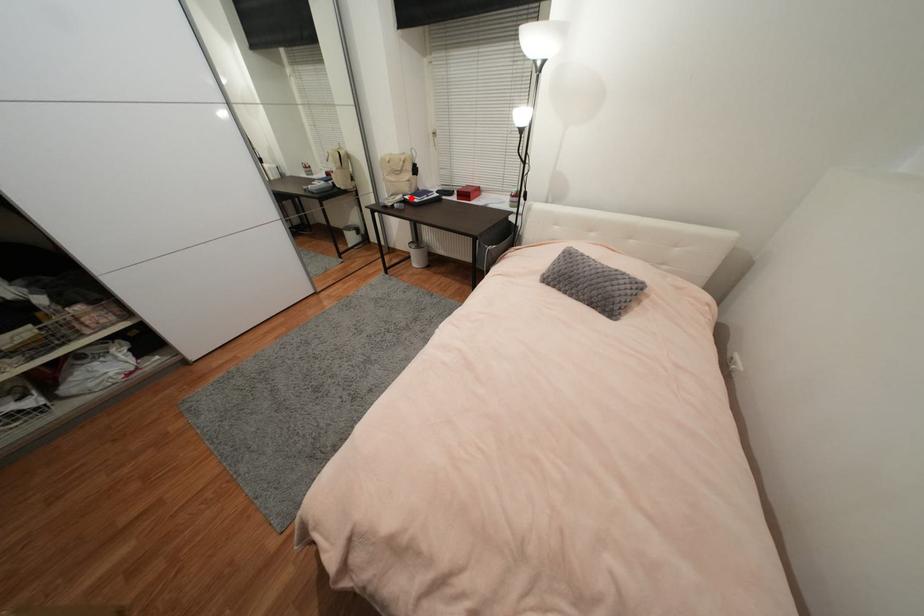
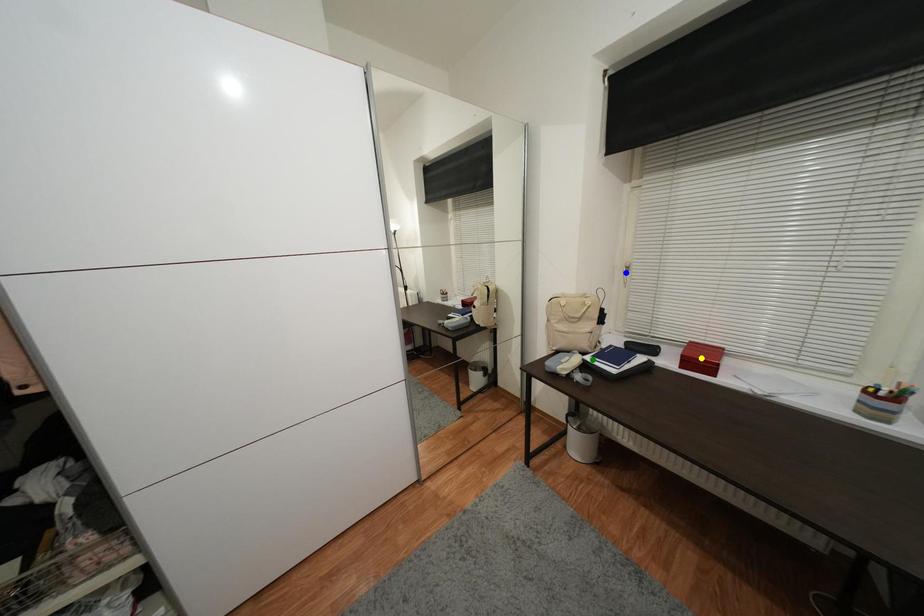
Question: I am providing you with two images of the same scene from different viewpoints. A red point is marked on the first image. You are given multiple points on the second image. In image 2, which mark is for the same physical point as the one in image 1?

Choices:
 (A) yellow point
 (B) blue point
 (C) green point

Answer: (C)